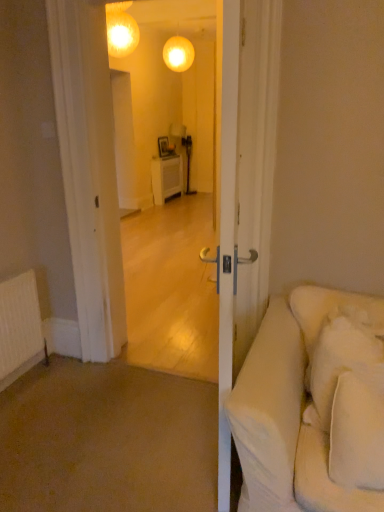
Question: From the image's perspective, would you say matte glass globe at upper center is positioned over white soft pillow at right, the second pillow when ordered from back to front?

Choices:
 (A) yes
 (B) no

Answer: (A)

Question: Is the position of matte glass globe at upper center more distant than that of white soft pillow at right, the second pillow when ordered from back to front?

Choices:
 (A) no
 (B) yes

Answer: (B)

Question: From a real-world perspective, is matte glass globe at upper center located beneath white soft pillow at right, which is the first pillow from front to back?

Choices:
 (A) no
 (B) yes

Answer: (A)

Question: Is matte glass globe at upper center not inside white soft pillow at right, the second pillow when ordered from back to front?

Choices:
 (A) yes
 (B) no

Answer: (A)

Question: From the image's perspective, is matte glass globe at upper center under white soft pillow at right, which is the first pillow from front to back?

Choices:
 (A) yes
 (B) no

Answer: (B)

Question: Is matte glass globe at upper center wider than white soft pillow at right, which is the first pillow from front to back?

Choices:
 (A) no
 (B) yes

Answer: (B)

Question: Considering the relative sizes of white soft pillow at right, which is the 1th pillow from back to front, and matte glass globe at upper center in the image provided, is white soft pillow at right, which is the 1th pillow from back to front, shorter than matte glass globe at upper center?

Choices:
 (A) no
 (B) yes

Answer: (A)

Question: Does white soft pillow at right, arranged as the 2th pillow when viewed from the front, touch matte glass globe at upper center?

Choices:
 (A) yes
 (B) no

Answer: (B)

Question: Is white soft pillow at right, arranged as the 2th pillow when viewed from the front, further to the viewer compared to matte glass globe at upper center?

Choices:
 (A) no
 (B) yes

Answer: (A)

Question: Considering the relative sizes of white soft pillow at right, which is the 1th pillow from back to front, and matte glass globe at upper center in the image provided, is white soft pillow at right, which is the 1th pillow from back to front, taller than matte glass globe at upper center?

Choices:
 (A) no
 (B) yes

Answer: (B)

Question: Is white soft pillow at right, which is the 1th pillow from back to front, in front of matte glass globe at upper center?

Choices:
 (A) yes
 (B) no

Answer: (A)

Question: From a real-world perspective, is white soft pillow at right, which is the 1th pillow from back to front, positioned over matte glass globe at upper center based on gravity?

Choices:
 (A) yes
 (B) no

Answer: (B)

Question: Could you tell me if white soft pillow at right, the second pillow when ordered from back to front, is turned towards white soft pillow at right, arranged as the 2th pillow when viewed from the front?

Choices:
 (A) yes
 (B) no

Answer: (B)